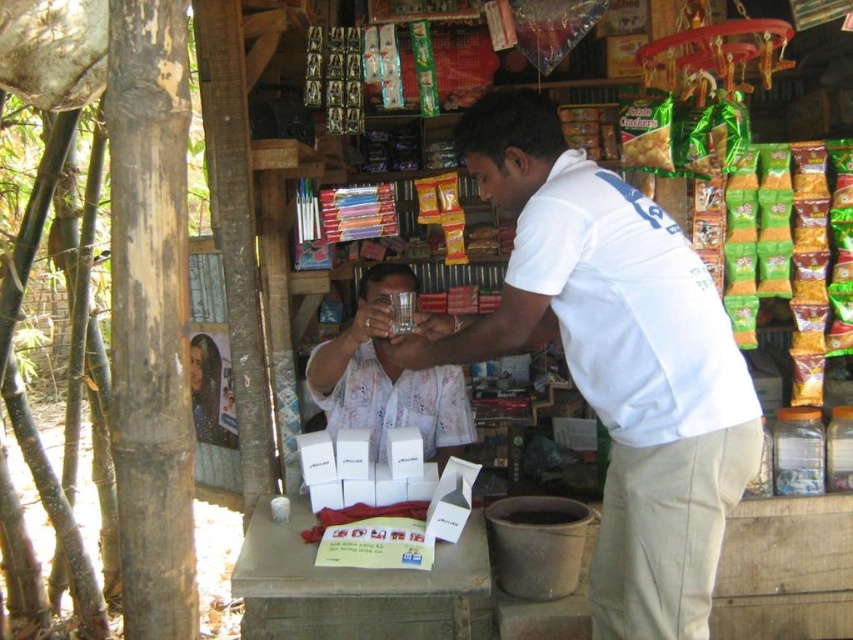
From the picture: Can you confirm if white cotton shirt at center is positioned below white matte glass at center?

Actually, white cotton shirt at center is above white matte glass at center.

Which is in front, point (682, 324) or point (399, 280)?

Point (682, 324)

At what (x,y) coordinates should I click in order to perform the action: click on white cotton shirt at center. Please return your answer as a coordinate pair (x, y). Looking at the image, I should click on (614, 358).